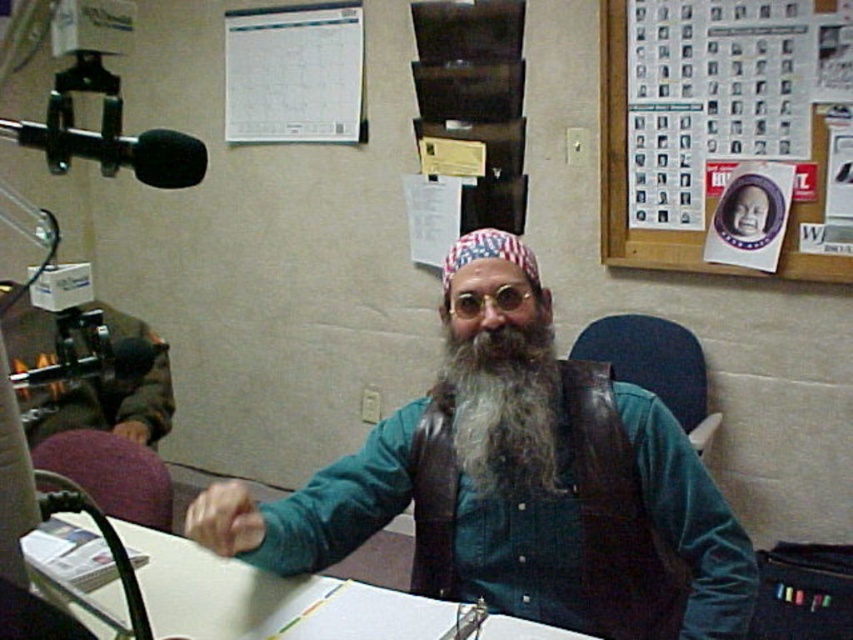
Question: Which object is the closest to the green denim shirt at center?

Choices:
 (A) wooden bulletin board at upper right
 (B) white paper at center
 (C) graywoollybeard at center

Answer: (C)

Question: Can you confirm if white paper at center is smaller than graywoollybeard at center?

Choices:
 (A) no
 (B) yes

Answer: (A)

Question: Considering the relative positions of green denim shirt at center and white paper at center in the image provided, where is green denim shirt at center located with respect to white paper at center?

Choices:
 (A) right
 (B) left

Answer: (A)

Question: Can you confirm if graywoollybeard at center is wider than wooden bulletin board at upper right?

Choices:
 (A) yes
 (B) no

Answer: (B)

Question: Considering the real-world distances, which object is farthest from the green denim shirt at center?

Choices:
 (A) white paper at center
 (B) graywoollybeard at center

Answer: (A)

Question: Which point is closer to the camera?

Choices:
 (A) (183, 573)
 (B) (805, 275)
 (C) (503, 413)
 (D) (514, 595)

Answer: (C)